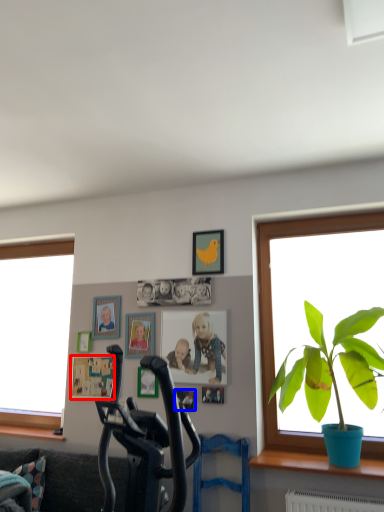
Question: Which point is further to the camera, picture frame (highlighted by a red box) or picture frame (highlighted by a blue box)?

Choices:
 (A) picture frame
 (B) picture frame

Answer: (A)